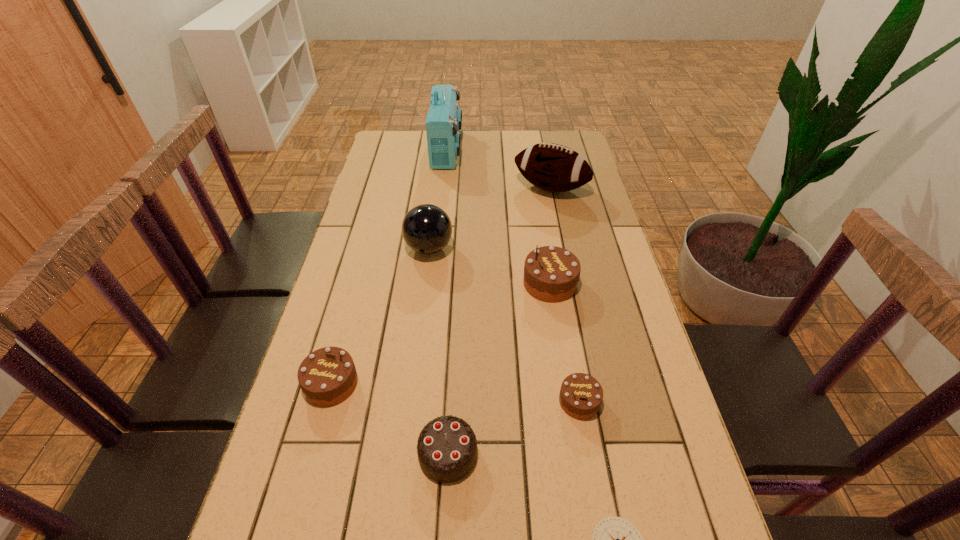
You are a GUI agent. You are given a task and a screenshot of the screen. Output one action in this format:
    pyautogui.click(x=<x>, y=<y>)
    Task: Click on the radio receiver
    The width and height of the screenshot is (960, 540).
    Given the screenshot: What is the action you would take?
    pyautogui.click(x=443, y=122)

In order to click on the farthest object in this screenshot , I will do `click(443, 122)`.

Where is `the seventh nearest object`? Image resolution: width=960 pixels, height=540 pixels. the seventh nearest object is located at coordinates (552, 167).

Image resolution: width=960 pixels, height=540 pixels. Identify the location of black bowling ball. (427, 229).

Locate an element on the screen. This screenshot has height=540, width=960. bowling ball is located at coordinates (427, 229).

The width and height of the screenshot is (960, 540). In order to click on the tallest chocolate cake in this screenshot , I will do `click(551, 274)`.

Locate an element on the screen. The width and height of the screenshot is (960, 540). the biggest brown chocolate cake is located at coordinates (551, 274).

The image size is (960, 540). What are the coordinates of `the leftmost chocolate cake` in the screenshot? It's located at (327, 376).

I want to click on the leftmost brown chocolate cake, so click(x=327, y=376).

The height and width of the screenshot is (540, 960). I want to click on the seventh farthest object, so pyautogui.click(x=447, y=447).